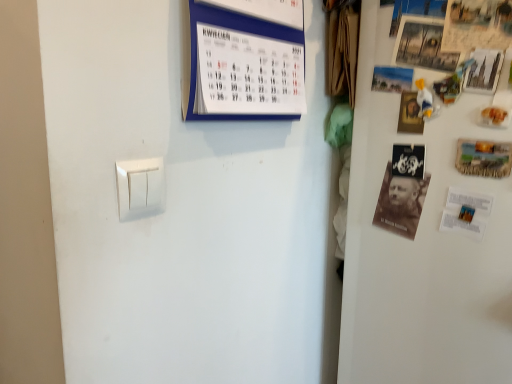
Measure the distance between brown paper at right, acting as the first magazine starting from the right, and camera.

The distance of brown paper at right, acting as the first magazine starting from the right, from camera is 34.17 inches.

What do you see at coordinates (421, 249) in the screenshot? I see `white matte fridge at upper right` at bounding box center [421, 249].

Identify the location of matte paper poster at upper right, which ranks as the third poster in right-to-left order. (392, 79).

Measure the distance between wooden framed poster at upper right, the 2th poster in the right-to-left sequence, and camera.

The depth of wooden framed poster at upper right, the 2th poster in the right-to-left sequence, is 31.46 inches.

Find the location of a particular element. Image resolution: width=512 pixels, height=384 pixels. wooden postcard at right is located at coordinates (484, 158).

Find the location of a particular element. This screenshot has height=384, width=512. metallic silver poster at upper right, which is the first poster from right to left is located at coordinates (483, 71).

In order to click on brown paper at right, which is counted as the first magazine, starting from the bottom in this screenshot , I will do `click(402, 191)`.

Which point is more forward, (475, 81) or (456, 366)?

Positioned in front is point (475, 81).

From a real-world perspective, between metallic silver poster at upper right, the 3th poster in the left-to-right sequence, and white matte fridge at upper right, who is vertically lower?

white matte fridge at upper right, from a real-world perspective.

Considering the relative positions of metallic silver poster at upper right, which is the first poster from right to left, and white matte fridge at upper right in the image provided, is metallic silver poster at upper right, which is the first poster from right to left, to the left or to the right of white matte fridge at upper right?

From the image, it's evident that metallic silver poster at upper right, which is the first poster from right to left, is to the left of white matte fridge at upper right.

Consider the image. From a real-world perspective, which is physically below, matte paper poster at upper right, positioned as the 1th poster in left-to-right order, or metallic silver poster at upper right, which is the first poster from right to left?

In real-world perspective, matte paper poster at upper right, positioned as the 1th poster in left-to-right order, is lower.

Can you confirm if matte paper poster at upper right, which ranks as the third poster in right-to-left order, is bigger than metallic silver poster at upper right, the 3th poster in the left-to-right sequence?

Incorrect, matte paper poster at upper right, which ranks as the third poster in right-to-left order, is not larger than metallic silver poster at upper right, the 3th poster in the left-to-right sequence.

Does point (396, 76) appear closer or farther from the camera than point (472, 69)?

Point (396, 76) is positioned farther from the camera compared to point (472, 69).

Can you see wooden postcard at right touching brown paper at right, the 2th magazine when ordered from top to bottom?

No, wooden postcard at right is not in contact with brown paper at right, the 2th magazine when ordered from top to bottom.

Where is `the 1st magazine counting from the left of the wooden postcard at right`? This screenshot has width=512, height=384. the 1st magazine counting from the left of the wooden postcard at right is located at coordinates (402, 191).

Consider the image. How many degrees apart are the facing directions of wooden postcard at right and brown paper at right, the 2th magazine when ordered from top to bottom?

There is a 8.88-degree angle between the facing directions of wooden postcard at right and brown paper at right, the 2th magazine when ordered from top to bottom.

Do you think white plastic light switch at lower left is within wooden framed poster at upper right, marked as the 2th poster in a left-to-right arrangement, or outside of it?

white plastic light switch at lower left is located beyond the bounds of wooden framed poster at upper right, marked as the 2th poster in a left-to-right arrangement.

Locate an element on the screen. the 3rd poster directly above the white plastic light switch at lower left (from a real-world perspective) is located at coordinates (423, 44).

Consider the image. Is white plastic light switch at lower left thinner than wooden framed poster at upper right, marked as the 2th poster in a left-to-right arrangement?

Indeed, white plastic light switch at lower left has a lesser width compared to wooden framed poster at upper right, marked as the 2th poster in a left-to-right arrangement.

Consider the image. From the image's perspective, between matte paper poster at upper right, which ranks as the third poster in right-to-left order, and wooden postcard at right, who is located below?

wooden postcard at right is shown below in the image.

From a real-world perspective, is matte paper poster at upper right, positioned as the 1th poster in left-to-right order, physically located above or below wooden postcard at right?

Clearly, from a real-world perspective, matte paper poster at upper right, positioned as the 1th poster in left-to-right order, is above wooden postcard at right.

Is wooden postcard at right a part of matte paper poster at upper right, positioned as the 1th poster in left-to-right order?

No, wooden postcard at right is not inside matte paper poster at upper right, positioned as the 1th poster in left-to-right order.

Can you tell me how much matte paper poster at upper right, positioned as the 1th poster in left-to-right order, and wooden postcard at right differ in facing direction?

The angle between the facing direction of matte paper poster at upper right, positioned as the 1th poster in left-to-right order, and the facing direction of wooden postcard at right is 11.2 degrees.

Is white plastic light switch at lower left positioned far away from white matte fridge at upper right?

Actually, white plastic light switch at lower left and white matte fridge at upper right are a little close together.

The width and height of the screenshot is (512, 384). Find the location of `light switch above the white matte fridge at upper right (from a real-world perspective)`. light switch above the white matte fridge at upper right (from a real-world perspective) is located at coordinates (140, 188).

Is white plastic light switch at lower left facing away from white matte fridge at upper right?

No, white plastic light switch at lower left is not facing away from white matte fridge at upper right.

Is white matte fridge at upper right located within white plastic light switch at lower left?

No, white matte fridge at upper right is not surrounded by white plastic light switch at lower left.

Which is more to the right, white matte fridge at upper right or white plastic light switch at lower left?

Positioned to the right is white matte fridge at upper right.

Do you think white matte fridge at upper right is within white plastic light switch at lower left, or outside of it?

The correct answer is: outside.

Does white matte fridge at upper right turn towards white plastic light switch at lower left?

Yes, white matte fridge at upper right faces towards white plastic light switch at lower left.

The image size is (512, 384). In order to click on fridge in front of the metallic silver poster at upper right, which is the first poster from right to left in this screenshot , I will do `click(421, 249)`.

Where is `the 2nd poster counting from the left of the metallic silver poster at upper right, the 3th poster in the left-to-right sequence`? Image resolution: width=512 pixels, height=384 pixels. the 2nd poster counting from the left of the metallic silver poster at upper right, the 3th poster in the left-to-right sequence is located at coordinates (392, 79).

Considering their positions, is matte paper poster at upper right, which ranks as the third poster in right-to-left order, positioned further to white paper calendar at upper center, placed as the 2th magazine when sorted from right to left, than wooden postcard at right?

Based on the image, wooden postcard at right appears to be further to white paper calendar at upper center, placed as the 2th magazine when sorted from right to left.

Which object lies further to the anchor point brown paper at right, acting as the first magazine starting from the right, metallic silver poster at upper right, the 3th poster in the left-to-right sequence, or wooden postcard at right?

The object further to brown paper at right, acting as the first magazine starting from the right, is metallic silver poster at upper right, the 3th poster in the left-to-right sequence.

When comparing their distances from matte paper poster at upper right, positioned as the 1th poster in left-to-right order, does wooden framed poster at upper right, the 2th poster in the right-to-left sequence, or white paper calendar at upper center, arranged as the second magazine when ordered from the bottom, seem closer?

wooden framed poster at upper right, the 2th poster in the right-to-left sequence.

Looking at the image, which one is located closer to matte paper poster at upper right, which ranks as the third poster in right-to-left order, wooden postcard at right or white paper calendar at upper center, arranged as the second magazine when ordered from the bottom?

Based on the image, wooden postcard at right appears to be nearer to matte paper poster at upper right, which ranks as the third poster in right-to-left order.

Estimate the real-world distances between objects in this image. Which object is further from matte paper poster at upper right, positioned as the 1th poster in left-to-right order, white matte fridge at upper right or metallic silver poster at upper right, the 3th poster in the left-to-right sequence?

white matte fridge at upper right is positioned further to the anchor matte paper poster at upper right, positioned as the 1th poster in left-to-right order.

Considering their positions, is matte paper poster at upper right, which ranks as the third poster in right-to-left order, positioned closer to white matte fridge at upper right than metallic silver poster at upper right, which is the first poster from right to left?

matte paper poster at upper right, which ranks as the third poster in right-to-left order, lies closer to white matte fridge at upper right than the other object.

From the image, which object appears to be farther from matte paper poster at upper right, which ranks as the third poster in right-to-left order, brown paper at right, the 2th magazine when ordered from top to bottom, or wooden postcard at right?

Based on the image, brown paper at right, the 2th magazine when ordered from top to bottom, appears to be further to matte paper poster at upper right, which ranks as the third poster in right-to-left order.

Based on their spatial positions, is matte paper poster at upper right, which ranks as the third poster in right-to-left order, or wooden framed poster at upper right, marked as the 2th poster in a left-to-right arrangement, closer to white matte fridge at upper right?

The object closer to white matte fridge at upper right is matte paper poster at upper right, which ranks as the third poster in right-to-left order.

The width and height of the screenshot is (512, 384). I want to click on magazine situated between white paper calendar at upper center, arranged as the second magazine when ordered from the bottom, and wooden framed poster at upper right, the 2th poster in the right-to-left sequence, from left to right, so click(402, 191).

Identify the location of postcard between wooden framed poster at upper right, the 2th poster in the right-to-left sequence, and brown paper at right, the 2th magazine from the left, from top to bottom. (484, 158).

I want to click on postcard that lies between wooden framed poster at upper right, marked as the 2th poster in a left-to-right arrangement, and white matte fridge at upper right from top to bottom, so (x=484, y=158).

Identify the location of poster between white paper calendar at upper center, marked as the 1th magazine in a left-to-right arrangement, and wooden framed poster at upper right, the 2th poster in the right-to-left sequence. Image resolution: width=512 pixels, height=384 pixels. (392, 79).